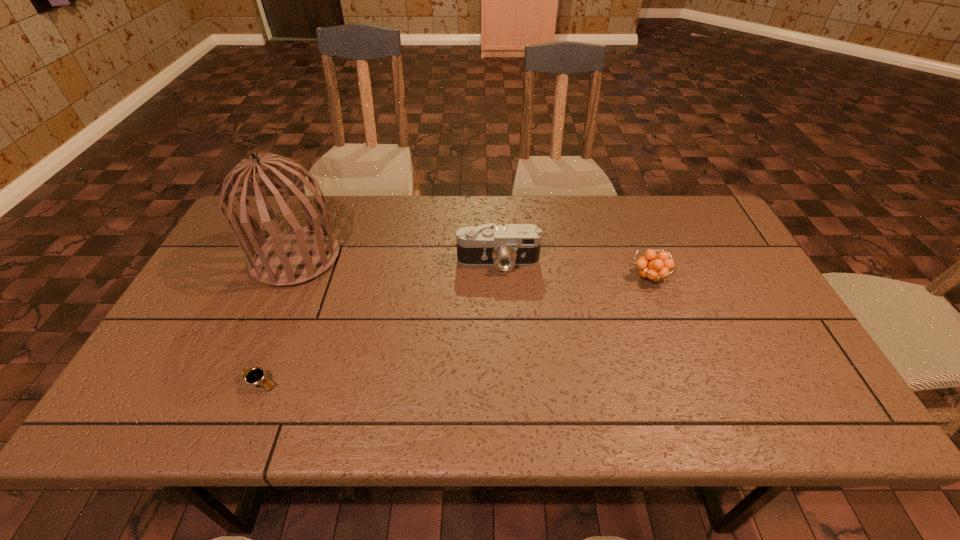
Where is `the tallest object`? Image resolution: width=960 pixels, height=540 pixels. the tallest object is located at coordinates (296, 255).

You are a GUI agent. You are given a task and a screenshot of the screen. Output one action in this format:
    pyautogui.click(x=<x>, y=<y>)
    Task: Click on the second tallest object
    The width and height of the screenshot is (960, 540).
    Given the screenshot: What is the action you would take?
    (x=504, y=247)

At what (x,y) coordinates should I click in order to perform the action: click on the second object from right to left. Please return your answer as a coordinate pair (x, y). The width and height of the screenshot is (960, 540). Looking at the image, I should click on (504, 247).

This screenshot has height=540, width=960. In order to click on orange fruit in this screenshot , I will do `click(652, 267)`.

Locate an element on the screen. The height and width of the screenshot is (540, 960). the third tallest object is located at coordinates (652, 267).

This screenshot has height=540, width=960. Identify the location of the shortest object. (252, 376).

Where is `the nearest object`? This screenshot has height=540, width=960. the nearest object is located at coordinates (252, 376).

This screenshot has width=960, height=540. Identify the location of vacant space located on the front of the birdcage. [x=255, y=350].

Locate an element on the screen. The image size is (960, 540). free spot located 0.260m on the lens of the second tallest object is located at coordinates 502,353.

This screenshot has height=540, width=960. I want to click on vacant space located 0.080m on the right of the orange fruit, so click(x=698, y=277).